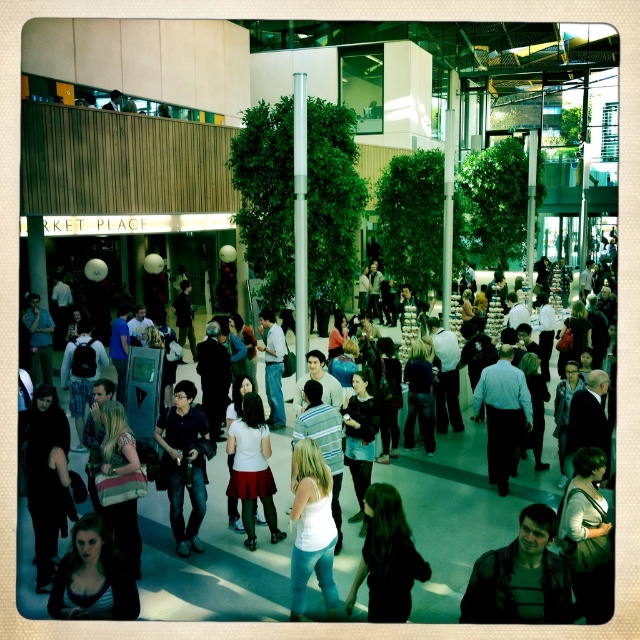
Does white matte tank top at center have a lesser height compared to white matte skirt at center?

Correct, white matte tank top at center is not as tall as white matte skirt at center.

Can you confirm if white matte tank top at center is positioned below white matte skirt at center?

Correct, white matte tank top at center is located below white matte skirt at center.

Identify the location of white matte tank top at center. (310, 529).

The height and width of the screenshot is (640, 640). I want to click on white matte tank top at center, so click(x=310, y=529).

Between point (516, 602) and point (401, 499), which one is positioned behind?

Positioned behind is point (401, 499).

Does matte black jacket at lower right appear over black fabric dress at center?

Correct, matte black jacket at lower right is located above black fabric dress at center.

Image resolution: width=640 pixels, height=640 pixels. What are the coordinates of `matte black jacket at lower right` in the screenshot? It's located at (520, 577).

Can you confirm if matte black jacket at lower right is positioned below matte black shirt at center?

Yes.

Does matte black jacket at lower right have a larger size compared to matte black shirt at center?

Incorrect, matte black jacket at lower right is not larger than matte black shirt at center.

Does point (544, 598) come closer to viewer compared to point (189, 518)?

Yes, it is in front of point (189, 518).

Locate an element on the screen. matte black jacket at lower right is located at coordinates (520, 577).